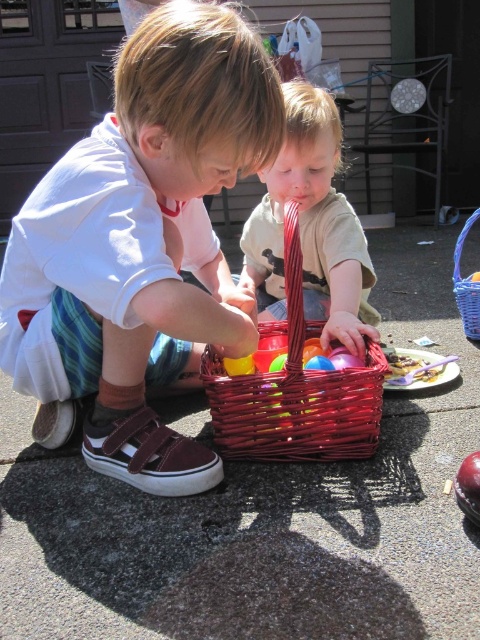
You are a photographer trying to capture a closeup of the bright red wicker basket at center without including the matte white shirt at center in the frame. Given their sizes, is this possible?

The matte white shirt at center is wider than the bright red wicker basket at center, so it might block part of the basket. To avoid including the shirt, you need to adjust your angle or move closer to focus solely on the basket.

You are a parent watching your children play. You have a new toy that is the same size as the bright red wicker basket at center. Can you place it next to the matte plastic toddler at center without moving the toddler?

The matte plastic toddler at center has a larger size compared to bright red wicker basket at center. Since the new toy is the same size as the basket, it would be smaller than the toddler. Therefore, there should be enough space to place the new toy next to the matte plastic toddler at center without moving it.